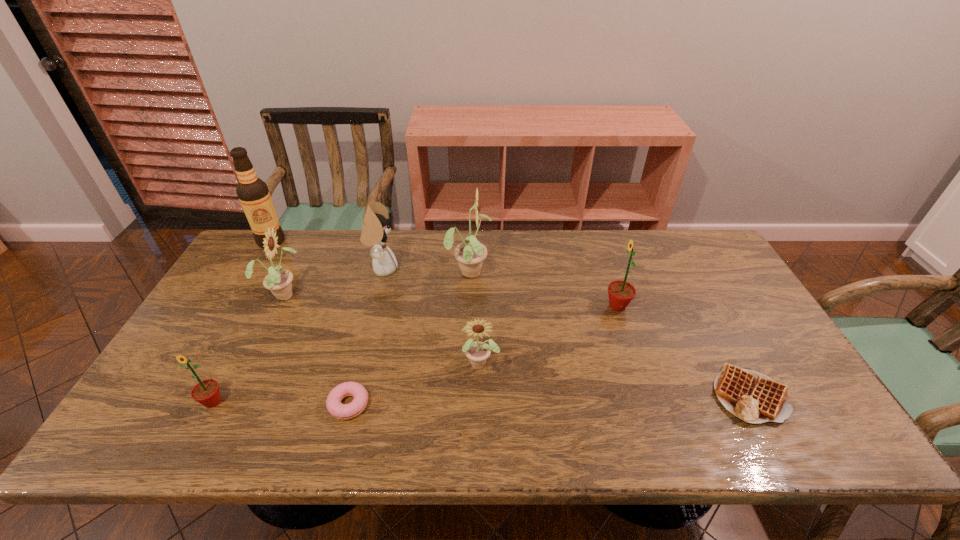
Locate an element on the screen. The width and height of the screenshot is (960, 540). alcohol is located at coordinates (253, 193).

Locate an element on the screen. This screenshot has width=960, height=540. the leftmost object is located at coordinates (253, 193).

The width and height of the screenshot is (960, 540). What are the coordinates of `the tallest sunflower` in the screenshot? It's located at (470, 254).

You are a GUI agent. You are given a task and a screenshot of the screen. Output one action in this format:
    pyautogui.click(x=<x>, y=<y>)
    Task: Click on the black doll
    
    Given the screenshot: What is the action you would take?
    pyautogui.click(x=376, y=225)

You are a GUI agent. You are given a task and a screenshot of the screen. Output one action in this format:
    pyautogui.click(x=<x>, y=<y>)
    Task: Click on the leftmost yellow sunflower
    This screenshot has width=960, height=540.
    Given the screenshot: What is the action you would take?
    pyautogui.click(x=278, y=281)

Image resolution: width=960 pixels, height=540 pixels. Find the location of `the farther green sunflower`. the farther green sunflower is located at coordinates (621, 293).

At what (x,y) coordinates should I click in order to perform the action: click on the right green sunflower. Please return your answer as a coordinate pair (x, y). The image size is (960, 540). Looking at the image, I should click on (621, 293).

Where is `the smallest yellow sunflower`? Image resolution: width=960 pixels, height=540 pixels. the smallest yellow sunflower is located at coordinates (477, 352).

Locate an element on the screen. The image size is (960, 540). the nearest yellow sunflower is located at coordinates (477, 352).

The width and height of the screenshot is (960, 540). In order to click on the nearest sunflower in this screenshot , I will do `click(206, 392)`.